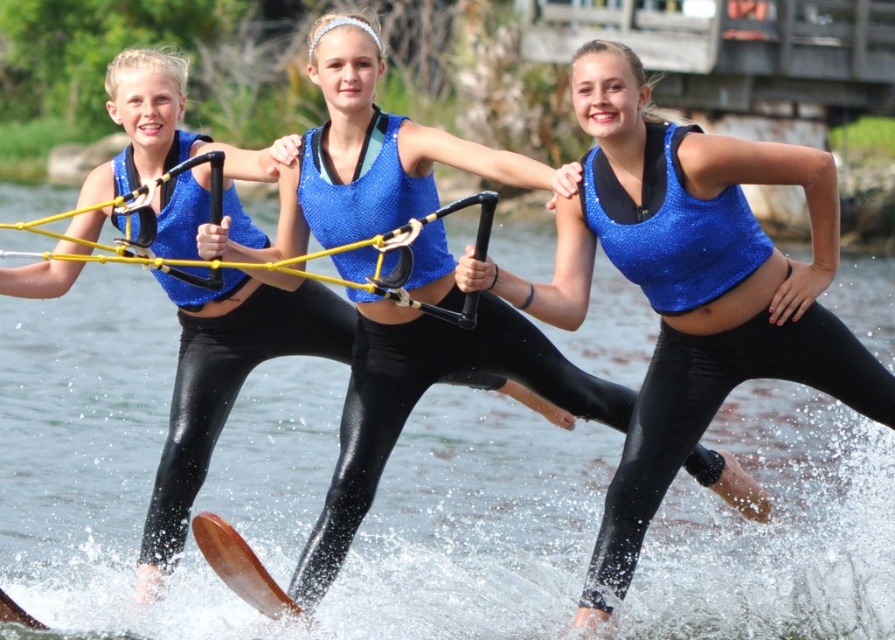
Question: Among these points, which one is nearest to the camera?

Choices:
 (A) (797, 333)
 (B) (58, 218)

Answer: (A)

Question: Does clear water at center appear over yellow rubber rope at center?

Choices:
 (A) yes
 (B) no

Answer: (B)

Question: Is clear water at center thinner than yellow rubber rope at center?

Choices:
 (A) no
 (B) yes

Answer: (A)

Question: Which is farther from the clear water at center?

Choices:
 (A) black matte wetsuit at center
 (B) brown wooden water ski at lower left

Answer: (B)

Question: Can you confirm if black matte wetsuit at center is bigger than shiny blue fabric at center?

Choices:
 (A) no
 (B) yes

Answer: (B)

Question: Based on their relative distances, which object is farther from the clear water at center?

Choices:
 (A) black matte wetsuit at center
 (B) brown wooden water ski at lower left
 (C) yellow rubber rope at center

Answer: (B)